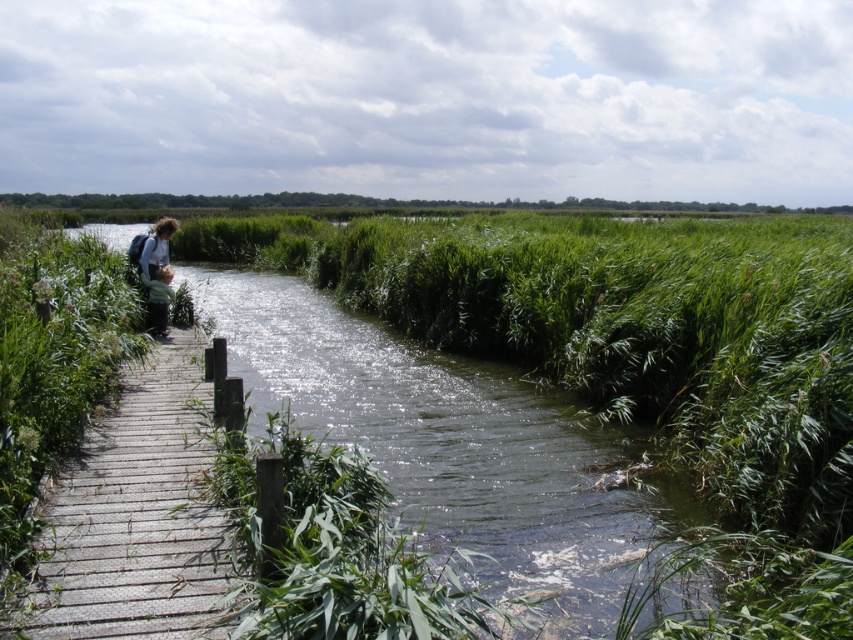
Is wooden planks at left thinner than light brown fabric child at left?

No, wooden planks at left is not thinner than light brown fabric child at left.

Locate an element on the screen. wooden planks at left is located at coordinates (135, 515).

Can you confirm if wooden planks at left is positioned to the left of light brown hair at left?

No, wooden planks at left is not to the left of light brown hair at left.

Which is behind, point (154, 621) or point (170, 220)?

The point (170, 220) is behind.

Who is more distant from viewer, (15, 618) or (148, 252)?

Point (148, 252)

The image size is (853, 640). I want to click on wooden planks at left, so click(135, 515).

Does light brown hair at left appear on the left side of light brown fabric child at left?

Indeed, light brown hair at left is positioned on the left side of light brown fabric child at left.

Which of these two, light brown hair at left or light brown fabric child at left, stands shorter?

With less height is light brown fabric child at left.

Does point (149, 248) come in front of point (163, 278)?

Yes, it is in front of point (163, 278).

Locate an element on the screen. Image resolution: width=853 pixels, height=640 pixels. light brown hair at left is located at coordinates (155, 248).